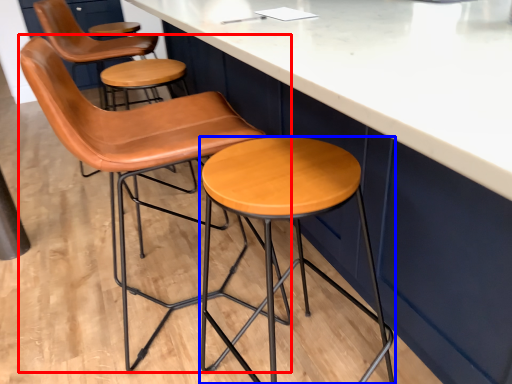
Question: Which point is further to the camera, chair (highlighted by a red box) or stool (highlighted by a blue box)?

Choices:
 (A) chair
 (B) stool

Answer: (A)